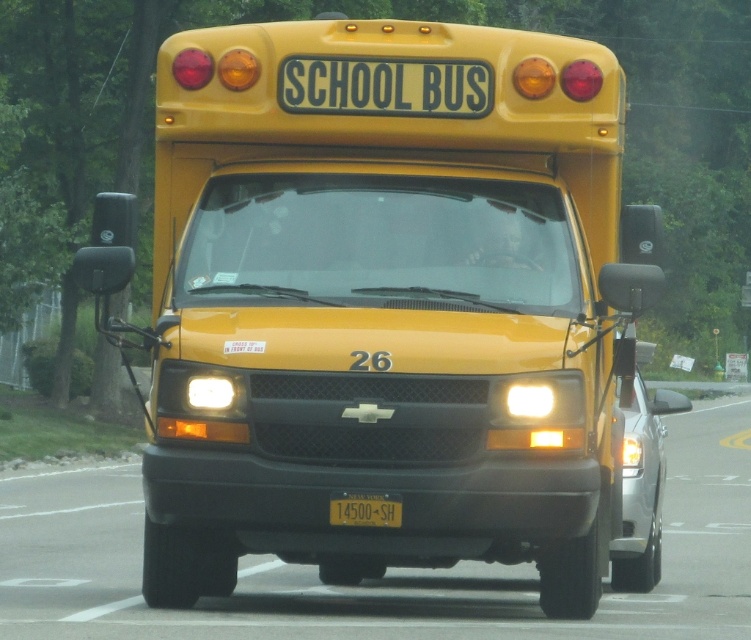
You are standing on the sidewalk next to the yellow school bus. A friend asks you to estimate how far the point at coordinates point (493, 342) is from you. What would you tell them?

The point at coordinates point (493, 342) is 27.90 feet away from you.